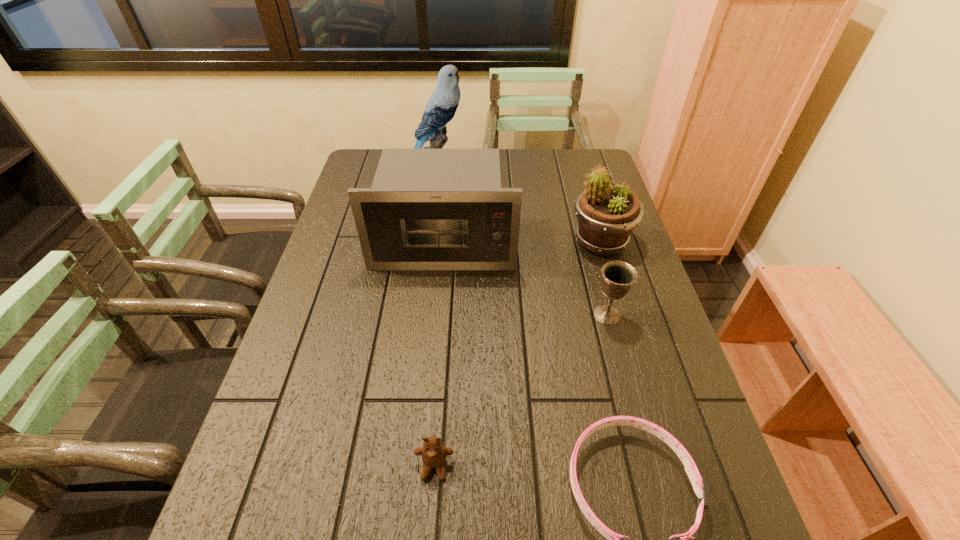
This screenshot has width=960, height=540. What are the coordinates of `vacant area situated on the left of the third nearest object` in the screenshot? It's located at (470, 315).

This screenshot has height=540, width=960. I want to click on object that is positioned at the far edge, so click(441, 107).

Find the location of a particular element. object at the left edge is located at coordinates (428, 209).

Identify the location of flowerpot at the right edge. (606, 214).

Identify the location of chalice at the right edge. (618, 276).

This screenshot has height=540, width=960. I want to click on free space at the far edge of the desktop, so click(x=545, y=168).

Identify the location of vacant space at the left edge. (291, 377).

Find the location of a particular element. This screenshot has width=960, height=540. free space at the right edge of the desktop is located at coordinates (647, 436).

What are the coordinates of `free space at the far right corner of the desktop` in the screenshot? It's located at (596, 166).

Image resolution: width=960 pixels, height=540 pixels. In order to click on vacant point located between the fourth farthest object and the farthest object in this screenshot , I will do 520,245.